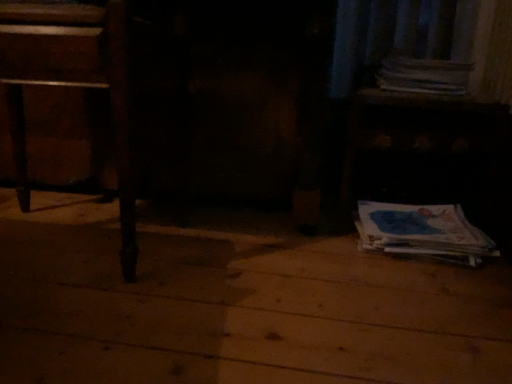
The height and width of the screenshot is (384, 512). Find the location of `vacant space in front of wooden table at lower right`. vacant space in front of wooden table at lower right is located at coordinates (400, 284).